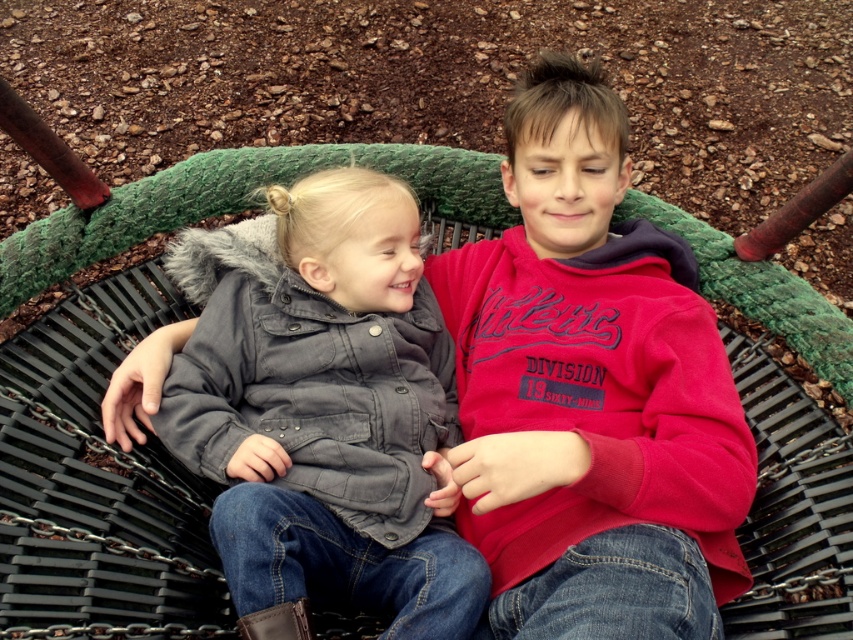
Question: Can you confirm if matte red hoodie at center is positioned below gray matte jacket at center?

Choices:
 (A) no
 (B) yes

Answer: (A)

Question: Which point is farther from the camera taking this photo?

Choices:
 (A) (451, 548)
 (B) (590, 374)

Answer: (B)

Question: Which object appears closest to the camera in this image?

Choices:
 (A) gray matte jacket at center
 (B) matte red hoodie at center

Answer: (B)

Question: Is the position of matte red hoodie at center less distant than that of gray matte jacket at center?

Choices:
 (A) yes
 (B) no

Answer: (A)

Question: Does matte red hoodie at center appear on the right side of gray matte jacket at center?

Choices:
 (A) no
 (B) yes

Answer: (B)

Question: Which object appears closest to the camera in this image?

Choices:
 (A) matte red hoodie at center
 (B) gray matte jacket at center

Answer: (A)